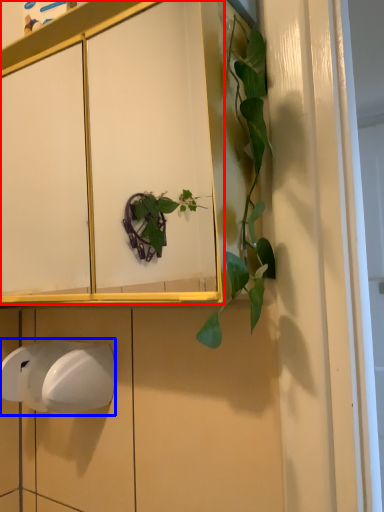
Question: Which object is further to the camera taking this photo, cabinetry (highlighted by a red box) or hand dryer (highlighted by a blue box)?

Choices:
 (A) cabinetry
 (B) hand dryer

Answer: (B)